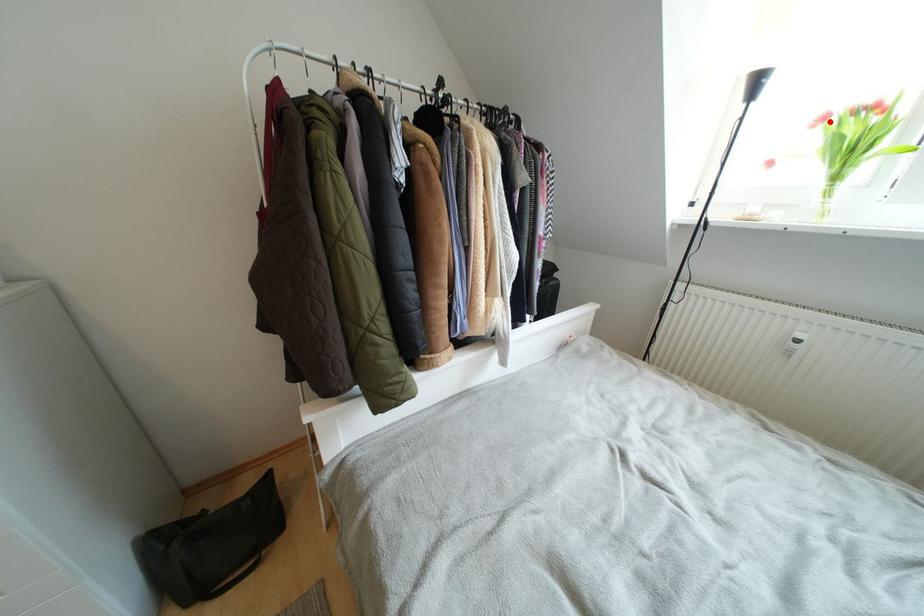
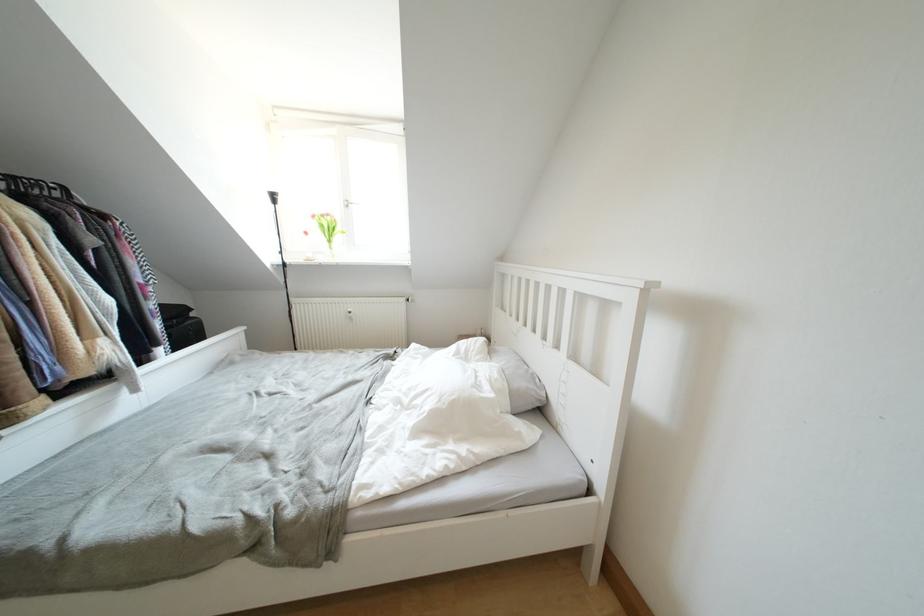
The point at the highlighted location is marked in the first image. Where is the corresponding point in the second image?

(319, 220)